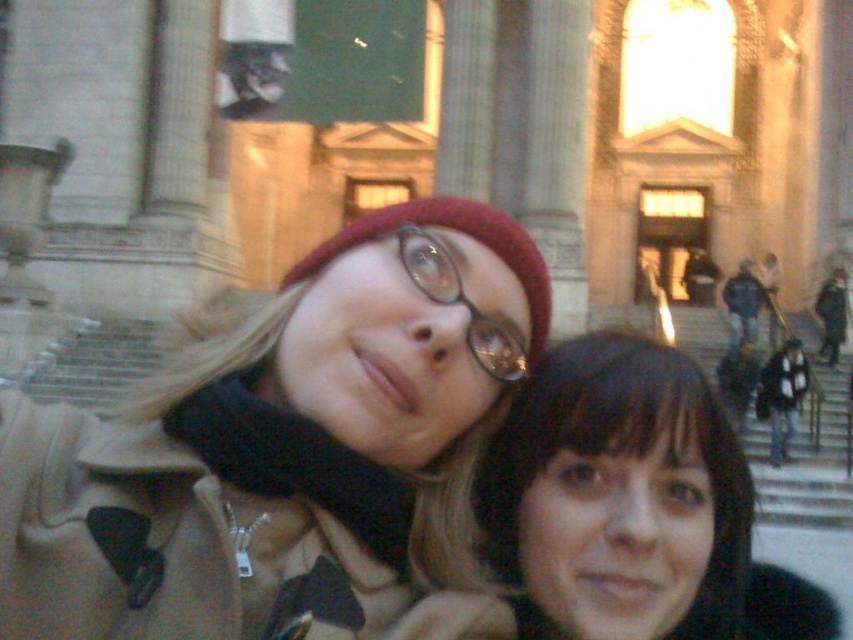
You are taking a photo of the black matte hair at lower right and the clear plastic glasses at center. Which object is positioned higher in the image?

The black matte hair at lower right is much taller than clear plastic glasses at center, so the black matte hair at lower right is positioned higher in the image.

You are a photographer trying to frame a shot of the matte beige coat at center and the black matte hair at lower right. Which object should you focus on first if you want to capture both in the frame without moving the camera?

The matte beige coat at center is wider than the black matte hair at lower right, so you should focus on the matte beige coat at center first to ensure it fits within the frame.

You are standing in front of the grand architectural structure and want to take a photo of the black matte hair at lower right. What are the exact coordinates where you should aim your camera?

The black matte hair at lower right is located at coordinates point (x=622, y=497).